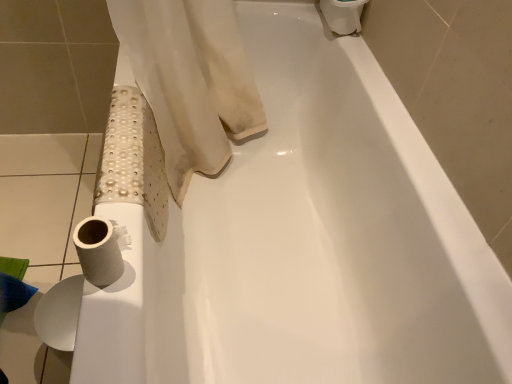
Question: Is white matte toilet paper at upper right, which is the first toilet paper from back to front, completely or partially inside white matte toilet paper at lower left, the 3th toilet paper in the back-to-front sequence?

Choices:
 (A) yes
 (B) no

Answer: (B)

Question: Can you confirm if white matte toilet paper at lower left, acting as the 2th toilet paper starting from the bottom, is positioned to the left of white matte toilet paper at upper right, which is counted as the first toilet paper, starting from the right?

Choices:
 (A) yes
 (B) no

Answer: (A)

Question: From a real-world perspective, is white matte toilet paper at lower left, marked as the 1th toilet paper in a front-to-back arrangement, positioned under white matte toilet paper at upper right, placed as the third toilet paper when sorted from left to right, based on gravity?

Choices:
 (A) yes
 (B) no

Answer: (A)

Question: From the image's perspective, does white matte toilet paper at lower left, which is counted as the second toilet paper, starting from the left, appear lower than white matte toilet paper at upper right, which is the first toilet paper from back to front?

Choices:
 (A) no
 (B) yes

Answer: (B)

Question: From a real-world perspective, is white matte toilet paper at lower left, which is counted as the second toilet paper, starting from the left, on top of white matte toilet paper at upper right, arranged as the 3th toilet paper when ordered from the bottom?

Choices:
 (A) no
 (B) yes

Answer: (A)

Question: Looking at the image, does white matte toilet paper at lower left, acting as the first toilet paper starting from the bottom, seem bigger or smaller compared to white matte toilet paper at lower left, the 3th toilet paper in the back-to-front sequence?

Choices:
 (A) big
 (B) small

Answer: (A)

Question: Is point (55, 316) closer or farther from the camera than point (83, 251)?

Choices:
 (A) farther
 (B) closer

Answer: (A)

Question: In terms of height, does white matte toilet paper at lower left, the 3th toilet paper in the right-to-left sequence, look taller or shorter compared to white matte toilet paper at lower left, which is counted as the second toilet paper, starting from the left?

Choices:
 (A) short
 (B) tall

Answer: (B)

Question: Based on their positions, is white matte toilet paper at lower left, the first toilet paper in the left-to-right sequence, located to the left or right of white matte toilet paper at lower left, which is counted as the second toilet paper, starting from the left?

Choices:
 (A) right
 (B) left

Answer: (B)

Question: Is white matte toilet paper at upper right, which is the first toilet paper from back to front, wider or thinner than white matte toilet paper at lower left, the 3th toilet paper in the right-to-left sequence?

Choices:
 (A) wide
 (B) thin

Answer: (A)

Question: From the image's perspective, is white matte toilet paper at upper right, arranged as the 3th toilet paper when ordered from the bottom, positioned above or below white matte toilet paper at lower left, acting as the first toilet paper starting from the bottom?

Choices:
 (A) above
 (B) below

Answer: (A)

Question: Based on their positions, is white matte toilet paper at upper right, which is counted as the first toilet paper, starting from the right, located to the left or right of white matte toilet paper at lower left, the 3th toilet paper in the right-to-left sequence?

Choices:
 (A) right
 (B) left

Answer: (A)

Question: Is point (321, 0) positioned closer to the camera than point (74, 329)?

Choices:
 (A) closer
 (B) farther

Answer: (B)

Question: From their relative heights in the image, would you say white matte toilet paper at lower left, which is counted as the second toilet paper, starting from the right, is taller or shorter than white matte toilet paper at lower left, the 3th toilet paper in the right-to-left sequence?

Choices:
 (A) tall
 (B) short

Answer: (B)

Question: From a real-world perspective, is white matte toilet paper at lower left, which is counted as the second toilet paper, starting from the right, above or below white matte toilet paper at lower left, the 2th toilet paper when ordered from back to front?

Choices:
 (A) below
 (B) above

Answer: (B)